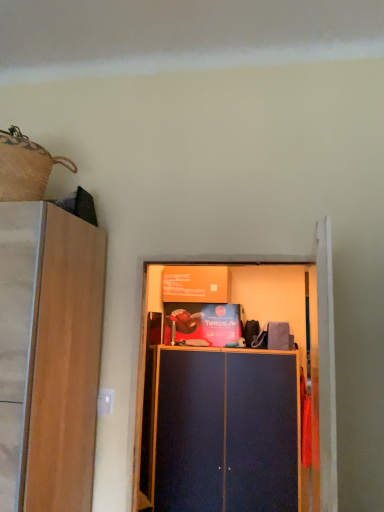
This screenshot has width=384, height=512. I want to click on matte dark blue cabinet at center, so click(x=226, y=432).

Describe the element at coordinates (226, 432) in the screenshot. I see `matte dark blue cabinet at center` at that location.

Where is `blue matte cupboard at center`? Image resolution: width=384 pixels, height=512 pixels. blue matte cupboard at center is located at coordinates click(x=235, y=387).

What do you see at coordinates (235, 387) in the screenshot? The image size is (384, 512). I see `blue matte cupboard at center` at bounding box center [235, 387].

In order to click on matte dark blue cabinet at center in this screenshot , I will do `click(226, 432)`.

Is blue matte cupboard at center to the left of matte dark blue cabinet at center from the viewer's perspective?

Yes.

Which is behind, blue matte cupboard at center or matte dark blue cabinet at center?

matte dark blue cabinet at center is further away from the camera.

Is point (319, 224) positioned behind point (198, 351)?

That is False.

Consider the image. From the image's perspective, is blue matte cupboard at center on top of matte dark blue cabinet at center?

Yes, from the image's perspective, blue matte cupboard at center is above matte dark blue cabinet at center.

From a real-world perspective, which object rests below the other?

In real-world perspective, matte dark blue cabinet at center is lower.

Which of these two, blue matte cupboard at center or matte dark blue cabinet at center, is wider?

With larger width is matte dark blue cabinet at center.

Does blue matte cupboard at center have a greater height compared to matte dark blue cabinet at center?

Incorrect, the height of blue matte cupboard at center is not larger of that of matte dark blue cabinet at center.

Is blue matte cupboard at center smaller than matte dark blue cabinet at center?

Indeed, blue matte cupboard at center has a smaller size compared to matte dark blue cabinet at center.

Would you say matte dark blue cabinet at center is part of blue matte cupboard at center's contents?

No, matte dark blue cabinet at center is not surrounded by blue matte cupboard at center.

Is blue matte cupboard at center far away from matte dark blue cabinet at center?

No, blue matte cupboard at center is in close proximity to matte dark blue cabinet at center.

Based on the photo, is blue matte cupboard at center aimed at matte dark blue cabinet at center?

No, blue matte cupboard at center is not oriented towards matte dark blue cabinet at center.

You are a GUI agent. You are given a task and a screenshot of the screen. Output one action in this format:
    pyautogui.click(x=<x>, y=<y>)
    Task: Click on the cabinetry behind the blue matte cupboard at center
    
    Given the screenshot: What is the action you would take?
    pyautogui.click(x=226, y=432)

Between matte dark blue cabinet at center and blue matte cupboard at center, which one appears on the right side from the viewer's perspective?

matte dark blue cabinet at center.

Which object is more forward, matte dark blue cabinet at center or blue matte cupboard at center?

blue matte cupboard at center is more forward.

Which is closer to the camera, (274, 447) or (179, 394)?

The point (274, 447) is closer to the camera.

From the image's perspective, is matte dark blue cabinet at center located beneath blue matte cupboard at center?

Yes.

From a real-world perspective, is matte dark blue cabinet at center physically above blue matte cupboard at center?

Actually, matte dark blue cabinet at center is physically below blue matte cupboard at center in the real world.

Which of these two, matte dark blue cabinet at center or blue matte cupboard at center, is thinner?

With smaller width is blue matte cupboard at center.

Is matte dark blue cabinet at center taller than blue matte cupboard at center?

Indeed, matte dark blue cabinet at center has a greater height compared to blue matte cupboard at center.

In terms of size, does matte dark blue cabinet at center appear bigger or smaller than blue matte cupboard at center?

matte dark blue cabinet at center is bigger than blue matte cupboard at center.

Does matte dark blue cabinet at center contain blue matte cupboard at center?

No.

Are matte dark blue cabinet at center and blue matte cupboard at center making contact?

Yes, matte dark blue cabinet at center is in contact with blue matte cupboard at center.

Is matte dark blue cabinet at center facing away from blue matte cupboard at center?

No.

Can you tell me how much matte dark blue cabinet at center and blue matte cupboard at center differ in facing direction?

0.0254 degrees separate the facing orientations of matte dark blue cabinet at center and blue matte cupboard at center.

Measure the distance between matte dark blue cabinet at center and blue matte cupboard at center.

A distance of 3.34 inches exists between matte dark blue cabinet at center and blue matte cupboard at center.

Where is `cabinetry that is on the right side of blue matte cupboard at center`? The height and width of the screenshot is (512, 384). cabinetry that is on the right side of blue matte cupboard at center is located at coordinates click(226, 432).

Find the location of a particular element. The height and width of the screenshot is (512, 384). cupboard to the left of matte dark blue cabinet at center is located at coordinates pyautogui.click(x=235, y=387).

At what (x,y) coordinates should I click in order to perform the action: click on cabinetry on the right side of blue matte cupboard at center. Please return your answer as a coordinate pair (x, y). Image resolution: width=384 pixels, height=512 pixels. Looking at the image, I should click on 226,432.